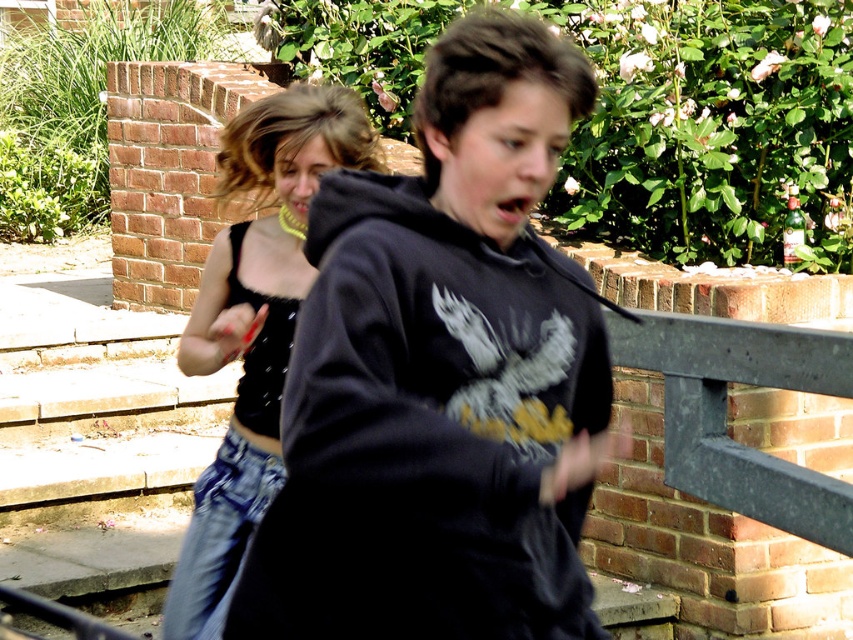
Is black matte hoodie at center to the left of denim skirt at left from the viewer's perspective?

In fact, black matte hoodie at center is to the right of denim skirt at left.

Which is below, black matte hoodie at center or denim skirt at left?

denim skirt at left is lower down.

I want to click on black matte hoodie at center, so click(x=442, y=378).

In order to click on black matte hoodie at center in this screenshot , I will do `click(442, 378)`.